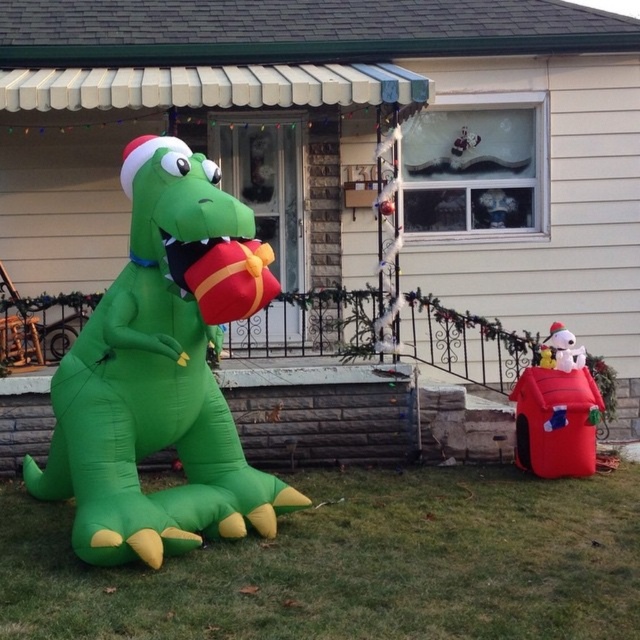
Question: Is green inflatable dinosaur at lower left positioned behind green inflatable dinosaur at left?

Choices:
 (A) no
 (B) yes

Answer: (A)

Question: Considering the relative positions of green inflatable dinosaur at left and red plush doghouse at lower right in the image provided, where is green inflatable dinosaur at left located with respect to red plush doghouse at lower right?

Choices:
 (A) below
 (B) above

Answer: (B)

Question: Considering the real-world distances, which object is closest to the green inflatable dinosaur at left?

Choices:
 (A) red plush doghouse at lower right
 (B) green inflatable dinosaur at lower left

Answer: (B)

Question: Can you confirm if green inflatable dinosaur at lower left is positioned below green inflatable dinosaur at left?

Choices:
 (A) yes
 (B) no

Answer: (A)

Question: Among these objects, which one is nearest to the camera?

Choices:
 (A) green inflatable dinosaur at left
 (B) green inflatable dinosaur at lower left

Answer: (B)

Question: Which point is closer to the camera?

Choices:
 (A) (545, 424)
 (B) (260, 586)
 (C) (177, 177)

Answer: (B)